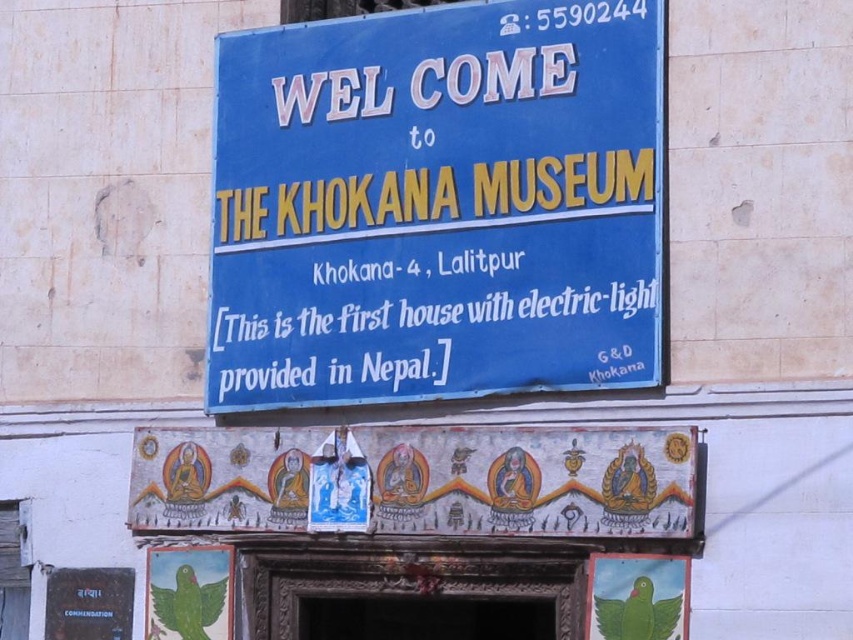
Question: Which object is closer to the camera taking this photo?

Choices:
 (A) blue plastic sign at upper center
 (B) painted wood banner at center

Answer: (B)

Question: Can you confirm if blue plastic sign at upper center is thinner than painted wood banner at center?

Choices:
 (A) no
 (B) yes

Answer: (B)

Question: Is blue plastic sign at upper center wider than painted wood banner at center?

Choices:
 (A) yes
 (B) no

Answer: (B)

Question: Which point is farther to the camera?

Choices:
 (A) (640, 515)
 (B) (213, 250)

Answer: (B)

Question: Observing the image, what is the correct spatial positioning of blue plastic sign at upper center in reference to painted wood banner at center?

Choices:
 (A) below
 (B) above

Answer: (B)